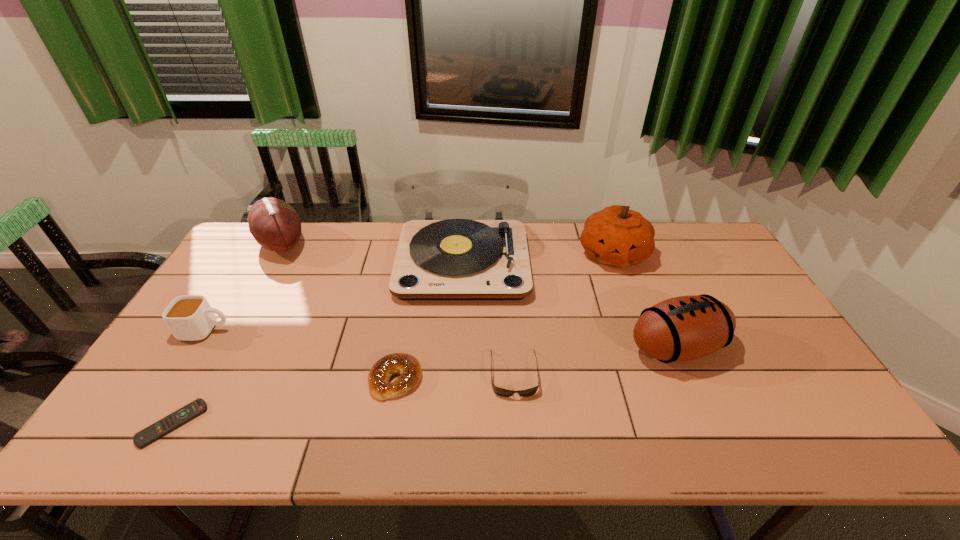
Identify the location of blank space located on the front of the farther football (American). This screenshot has height=540, width=960. (214, 364).

Where is `free space located on the front of the right football (American)`? This screenshot has height=540, width=960. free space located on the front of the right football (American) is located at coordinates (712, 431).

Find the location of a particular element. This screenshot has width=960, height=540. free space located on the side with the handle of the cup is located at coordinates (350, 330).

At what (x,y) coordinates should I click in order to perform the action: click on blank area located on the front of the bagel. Please return your answer as a coordinate pair (x, y). Image resolution: width=960 pixels, height=540 pixels. Looking at the image, I should click on (389, 421).

Identify the location of vacant space located 0.130m on the front-facing side of the sunglasses. Image resolution: width=960 pixels, height=540 pixels. (519, 450).

At what (x,y) coordinates should I click in order to perform the action: click on free location located on the back of the remote control. Please return your answer as a coordinate pair (x, y). The height and width of the screenshot is (540, 960). Looking at the image, I should click on (202, 373).

Where is `record player located in the far edge section of the desktop`? Image resolution: width=960 pixels, height=540 pixels. record player located in the far edge section of the desktop is located at coordinates (455, 259).

At what (x,y) coordinates should I click in order to perform the action: click on pumpkin present at the far edge. Please return your answer as a coordinate pair (x, y). The image size is (960, 540). Looking at the image, I should click on (616, 236).

Find the location of a particular element. football (American) that is at the far edge is located at coordinates (275, 225).

The width and height of the screenshot is (960, 540). I want to click on object present at the near edge, so click(x=150, y=434).